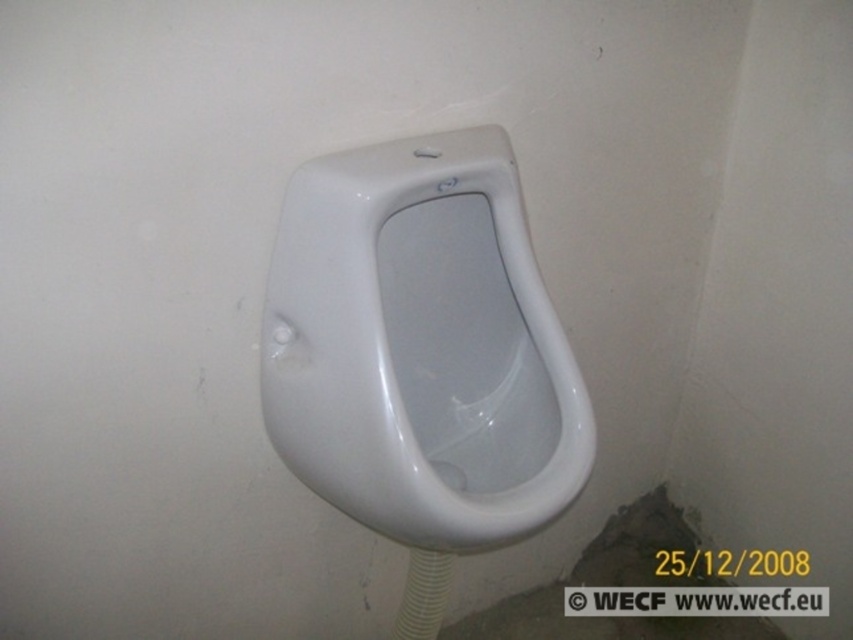
Question: Which of the following is the closest to the observer?

Choices:
 (A) white glossy urinal at center
 (B) white rubber pipe at lower center

Answer: (A)

Question: Is white glossy urinal at center further to camera compared to white rubber pipe at lower center?

Choices:
 (A) no
 (B) yes

Answer: (A)

Question: Which object appears closest to the camera in this image?

Choices:
 (A) white rubber pipe at lower center
 (B) white glossy urinal at center

Answer: (B)

Question: Is white glossy urinal at center wider than white rubber pipe at lower center?

Choices:
 (A) yes
 (B) no

Answer: (A)

Question: Considering the relative positions of white glossy urinal at center and white rubber pipe at lower center in the image provided, where is white glossy urinal at center located with respect to white rubber pipe at lower center?

Choices:
 (A) below
 (B) above

Answer: (B)